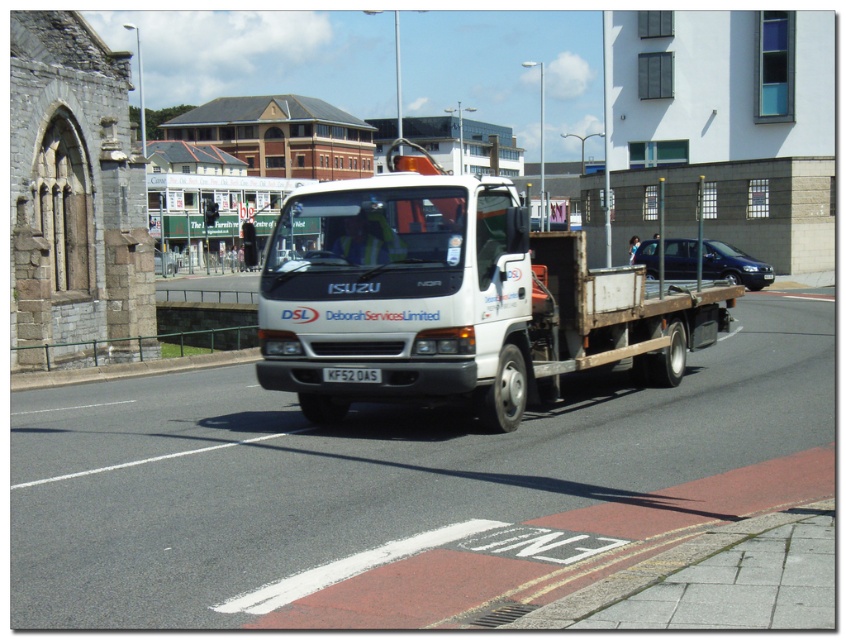
Question: Is white matte truck at center further to the viewer compared to white plastic license plate at center?

Choices:
 (A) yes
 (B) no

Answer: (B)

Question: Is white matte truck at center smaller than white plastic license plate at center?

Choices:
 (A) yes
 (B) no

Answer: (B)

Question: Which point is closer to the camera taking this photo?

Choices:
 (A) (330, 376)
 (B) (371, 275)

Answer: (B)

Question: Does dark blue metallic van at center appear under white plastic license plate at center?

Choices:
 (A) yes
 (B) no

Answer: (B)

Question: Which point is farther from the camera taking this photo?

Choices:
 (A) (684, 268)
 (B) (350, 369)
 (C) (501, 186)

Answer: (A)

Question: Among these points, which one is farthest from the camera?

Choices:
 (A) (332, 209)
 (B) (728, 273)
 (C) (367, 378)

Answer: (B)